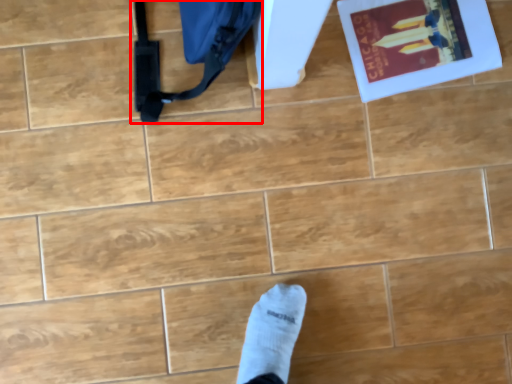
Question: Where is messenger bag (annotated by the red box) located in relation to paperback book in the image?

Choices:
 (A) left
 (B) right

Answer: (A)